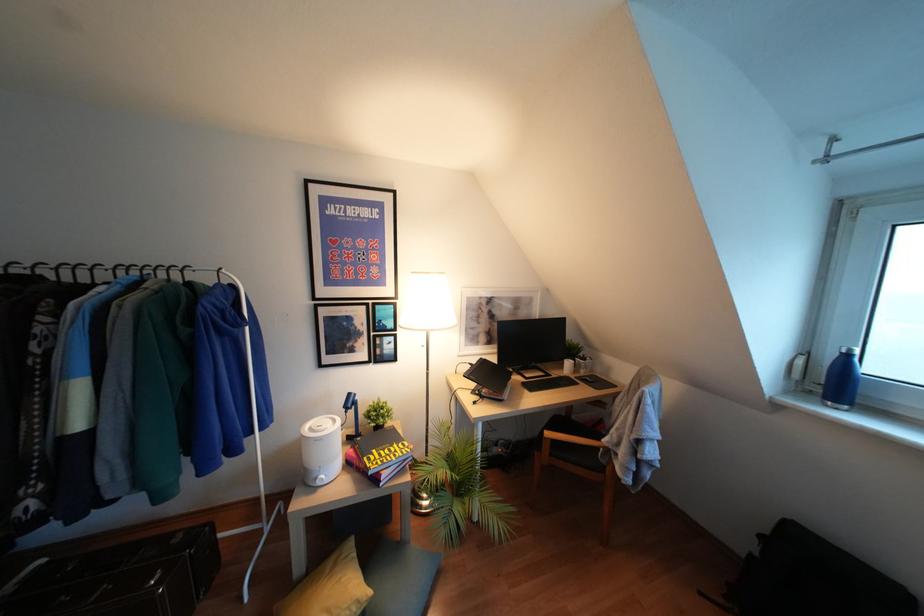
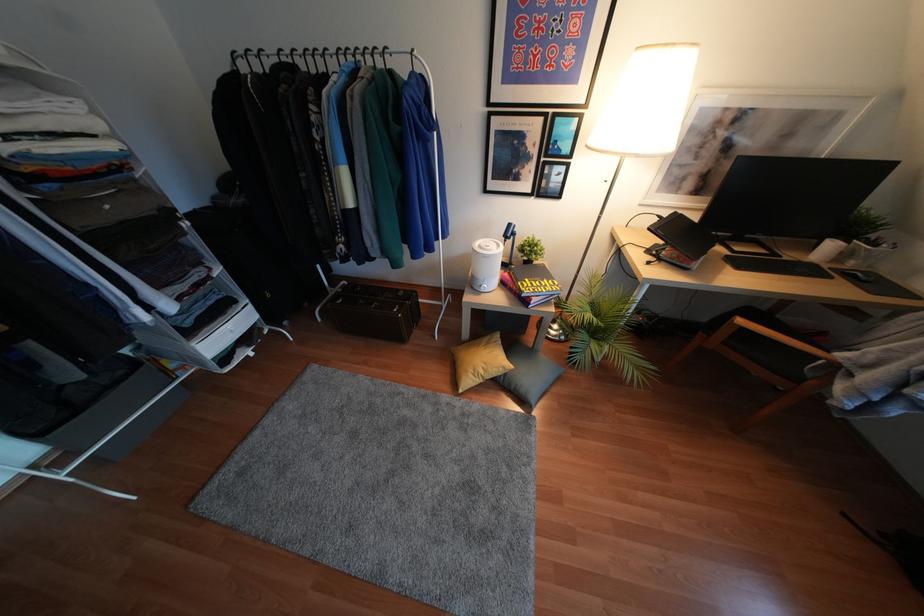
Find the pixel in the second image that matches point 592,381 in the first image.

(868, 281)